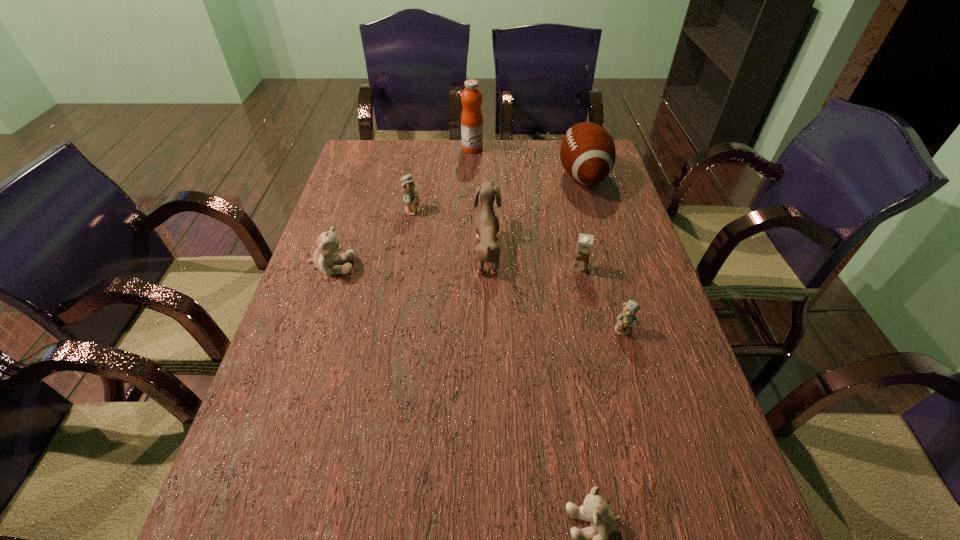
Where is `vacant space at the left edge of the desktop`? vacant space at the left edge of the desktop is located at coordinates (338, 204).

Locate an element on the screen. The width and height of the screenshot is (960, 540). free space at the right edge of the desktop is located at coordinates (660, 384).

The width and height of the screenshot is (960, 540). Identify the location of free area in between the brown football and the leftmost object. (458, 221).

Identify the location of free spot between the chocolate milk and the puppy. This screenshot has width=960, height=540. (534, 259).

Image resolution: width=960 pixels, height=540 pixels. Find the location of `free spot between the puppy and the chocolate milk`. free spot between the puppy and the chocolate milk is located at coordinates (534, 259).

Find the location of a particular element. This screenshot has height=540, width=960. unoccupied area between the farther blue teddy bear and the smaller blue teddy bear is located at coordinates (518, 269).

I want to click on vacant area that lies between the rightmost teddy bear and the orange fruit juice, so click(x=548, y=239).

I want to click on free space between the fruit juice and the football, so click(528, 162).

Locate an element on the screen. vacant space in between the fruit juice and the chocolate milk is located at coordinates (526, 208).

You are a GUI agent. You are given a task and a screenshot of the screen. Output one action in this format:
    pyautogui.click(x=<x>, y=<y>)
    Task: Click on the vacant region between the farther gray teddy bear and the farther blue teddy bear
    The width and height of the screenshot is (960, 540).
    Given the screenshot: What is the action you would take?
    (373, 239)